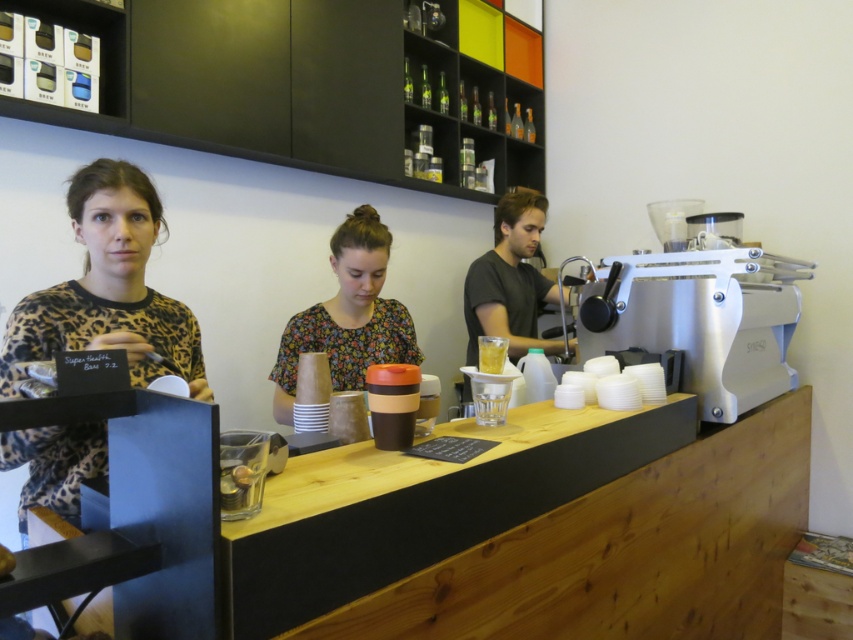
Measure the distance between point (283,419) and camera.

Point (283,419) and camera are 5.79 feet apart.

Is point (286, 381) farther from viewer compared to point (500, 362)?

Yes, it is behind point (500, 362).

Between point (352, 310) and point (498, 355), which one is positioned behind?

The point (352, 310) is behind.

Identify the location of floral fabric shirt at center. This screenshot has height=640, width=853. (347, 316).